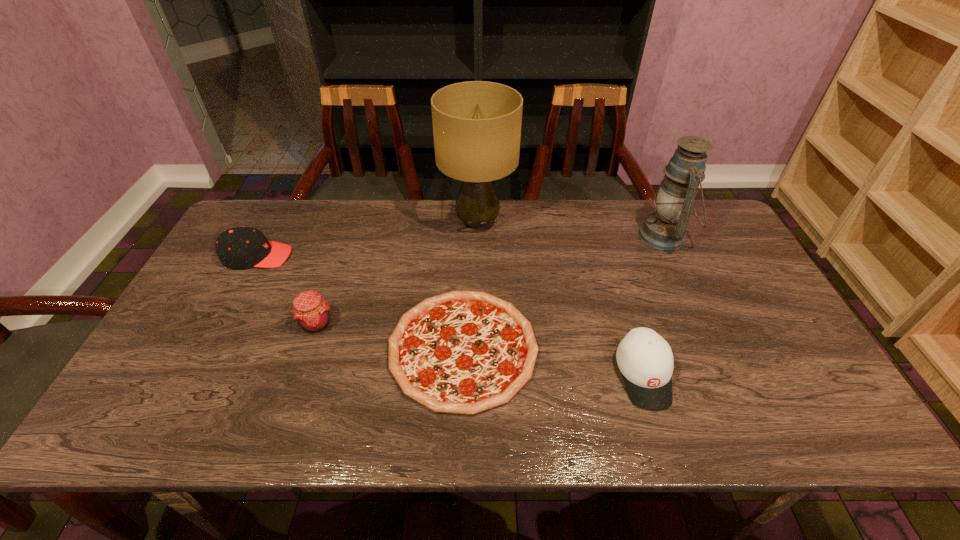
Identify the location of lampshade. This screenshot has width=960, height=540. (476, 124).

Find the location of `the fifth shortest object`. the fifth shortest object is located at coordinates (665, 229).

Locate an element on the screen. Image resolution: width=960 pixels, height=540 pixels. oil lamp is located at coordinates (665, 229).

Where is `cap`? This screenshot has width=960, height=540. cap is located at coordinates coord(240,247).

The width and height of the screenshot is (960, 540). I want to click on baseball cap, so click(645, 359).

Locate an element on the screen. Image resolution: width=960 pixels, height=540 pixels. jam is located at coordinates (312, 313).

You are a GUI agent. You are given a task and a screenshot of the screen. Output one action in this format:
    pyautogui.click(x=<x>, y=<y>)
    Task: Click on the shortest object
    This screenshot has height=540, width=960.
    Given the screenshot: What is the action you would take?
    pyautogui.click(x=463, y=352)

Image resolution: width=960 pixels, height=540 pixels. What are the coordinates of `vacant space situated 0.220m on the right of the lampshade` in the screenshot? It's located at (581, 222).

Find the location of `vacant space located 0.110m on the left of the second tallest object`. vacant space located 0.110m on the left of the second tallest object is located at coordinates (605, 236).

You are a GUI agent. You are given a task and a screenshot of the screen. Output one action in this format:
    pyautogui.click(x=<x>, y=<y>)
    Task: Click on the vacant space located on the front-facing side of the cap
    The image size is (960, 540).
    Given the screenshot: What is the action you would take?
    pyautogui.click(x=349, y=256)